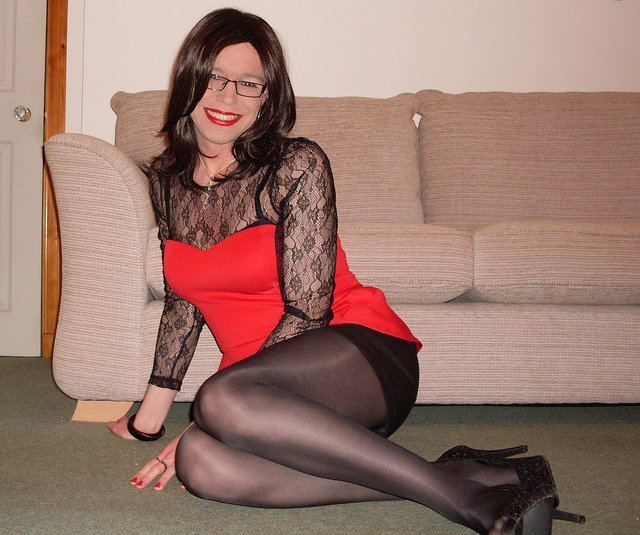
Identify the location of couch. This screenshot has width=640, height=535. (468, 214).